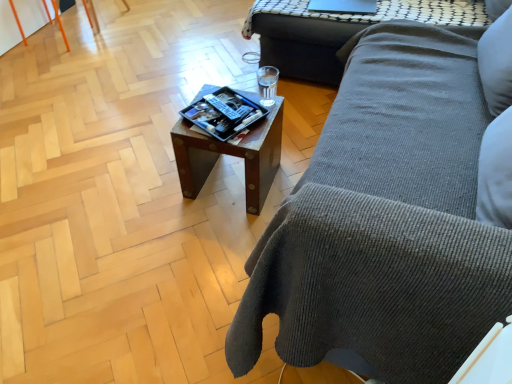
The image size is (512, 384). Find the location of `free space in front of wooden tray at center, the 1th table when ordered from bottom to top`. free space in front of wooden tray at center, the 1th table when ordered from bottom to top is located at coordinates (212, 238).